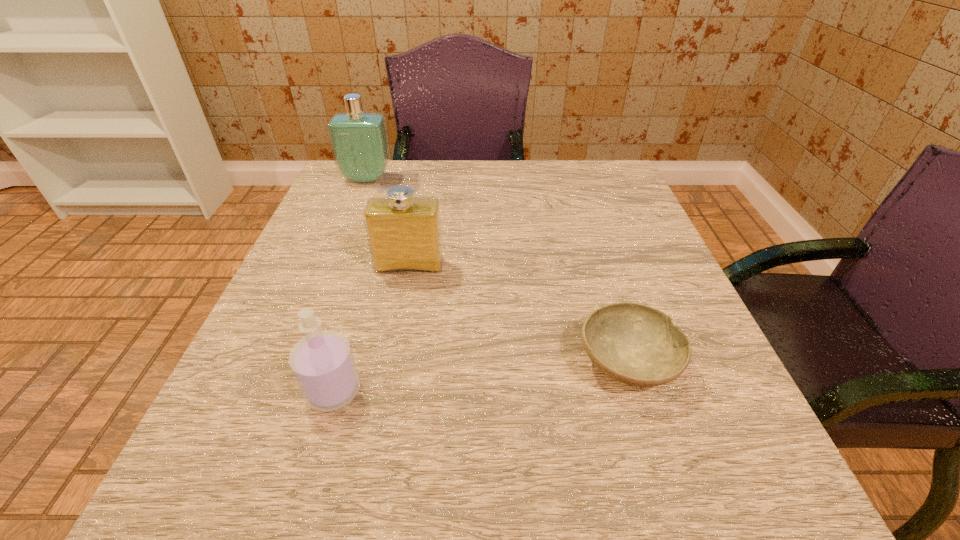
This screenshot has height=540, width=960. Find the location of `vacant space that satisfies the following two spatial constraints: 1. on the front label of the farthest perfume; 2. on the left side of the second shortest object`. vacant space that satisfies the following two spatial constraints: 1. on the front label of the farthest perfume; 2. on the left side of the second shortest object is located at coordinates (283, 390).